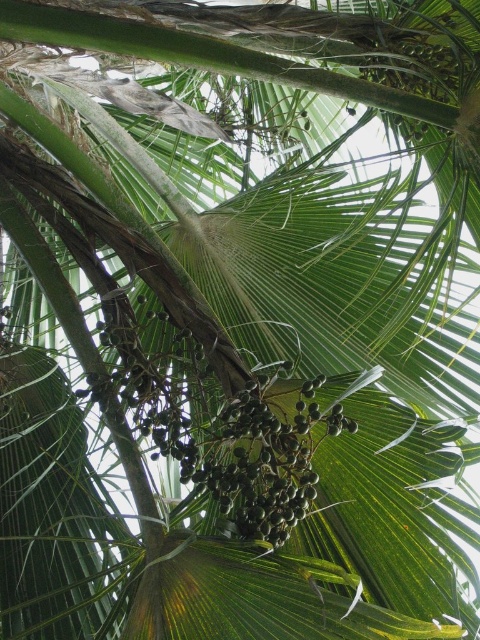
Which of these two, green matte fruit at center or green matte palm fruit at upper center, stands taller?

With more height is green matte fruit at center.

Can you confirm if green matte fruit at center is taller than green matte palm fruit at upper center?

Indeed, green matte fruit at center has a greater height compared to green matte palm fruit at upper center.

Between point (241, 477) and point (406, 49), which one is positioned behind?

The point (406, 49) is more distant.

This screenshot has width=480, height=640. I want to click on green matte fruit at center, so click(245, 452).